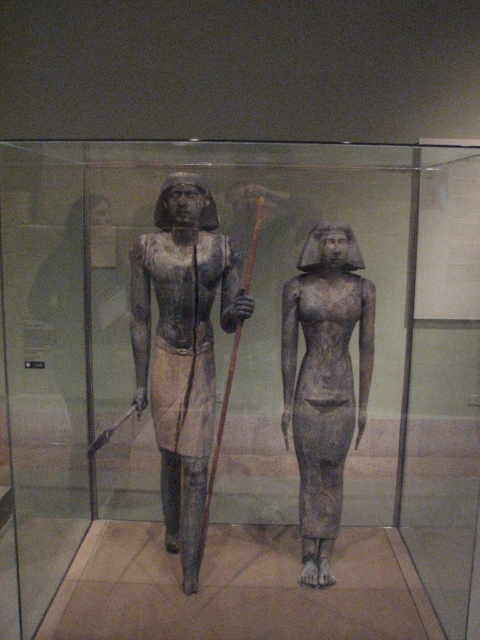
Does matte stone statue at center have a lesser width compared to gray stone statue at center?

Incorrect, matte stone statue at center's width is not less than gray stone statue at center's.

Is point (181, 384) positioned behind point (360, 436)?

No, (181, 384) is in front of (360, 436).

The image size is (480, 640). I want to click on matte stone statue at center, so click(x=182, y=348).